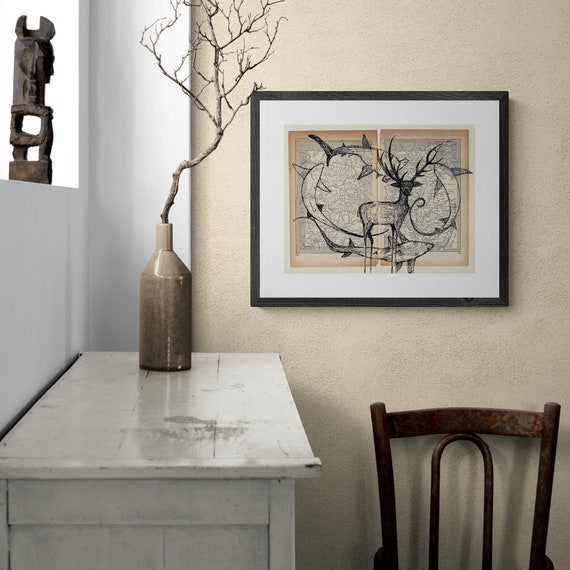
In order to click on 1 vase in this screenshot , I will do `click(154, 327)`.